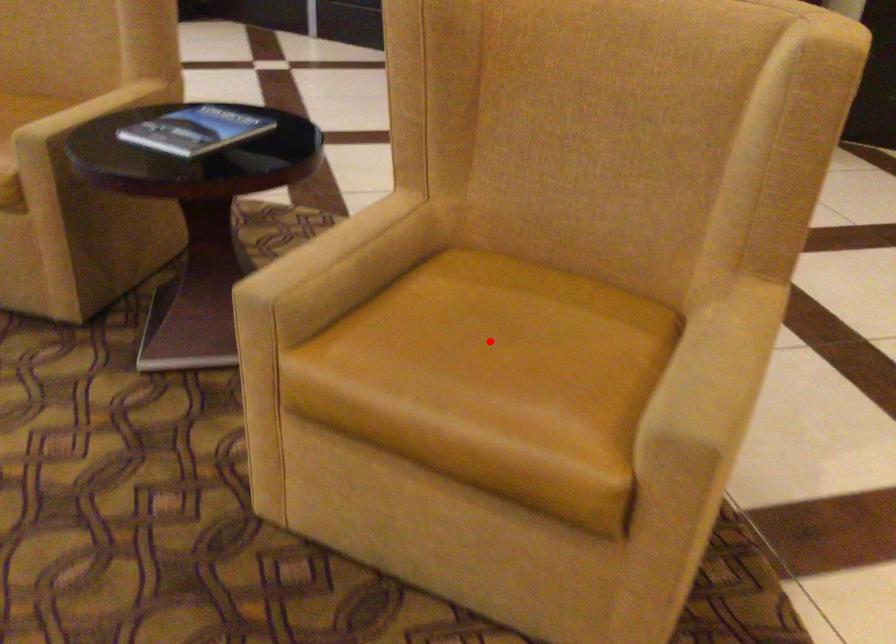
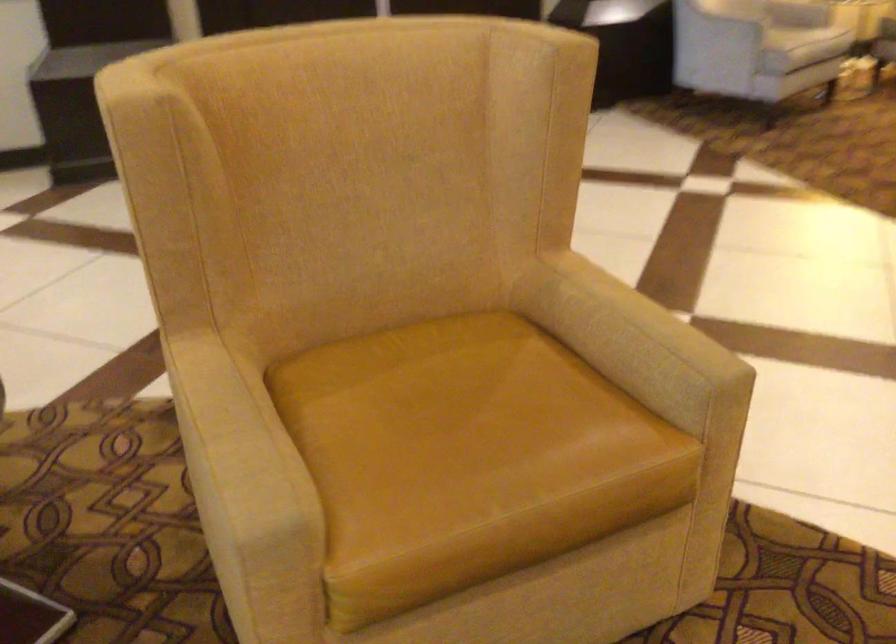
Find the pixel in the second image that matches the highlighted location in the first image.

(452, 426)